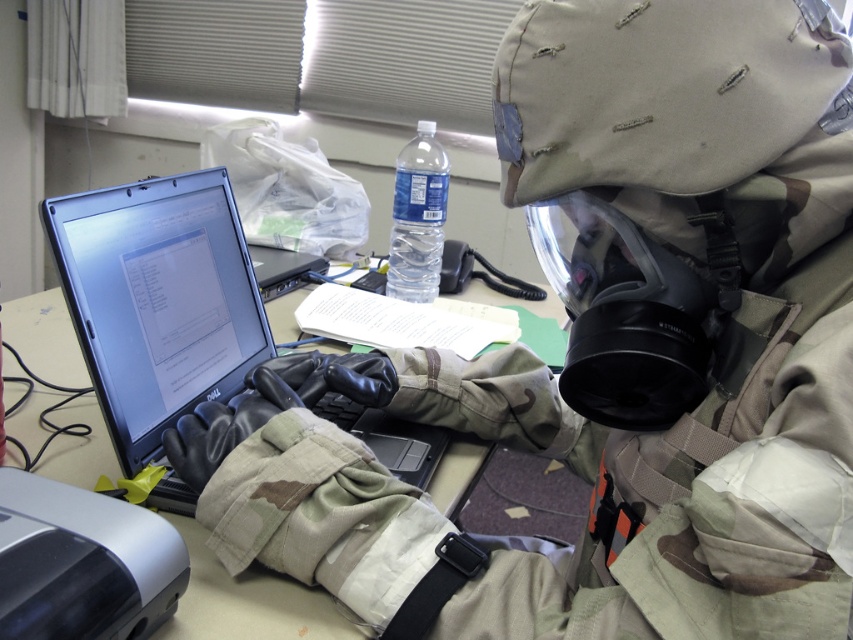
Question: Can you confirm if matte black laptop at center left is positioned below clear plastic bottle at center?

Choices:
 (A) yes
 (B) no

Answer: (A)

Question: Which of the following is the closest to the observer?

Choices:
 (A) matte black laptop at center
 (B) clear plastic bottle at center
 (C) matte black laptop at center left

Answer: (A)

Question: Can you confirm if matte black laptop at center left is smaller than clear plastic bottle at center?

Choices:
 (A) no
 (B) yes

Answer: (A)

Question: Which object appears farthest from the camera in this image?

Choices:
 (A) matte black laptop at center left
 (B) clear plastic bottle at center

Answer: (B)

Question: Can you confirm if matte black laptop at center is positioned above clear plastic bottle at center?

Choices:
 (A) no
 (B) yes

Answer: (A)

Question: Based on their relative distances, which object is nearer to the matte black laptop at center?

Choices:
 (A) clear plastic bottle at center
 (B) matte black laptop at center left

Answer: (B)